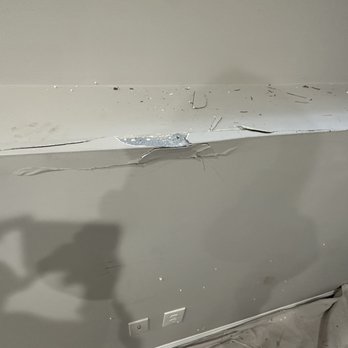
This screenshot has width=348, height=348. Identify the location of ethernet outlet. (133, 330).